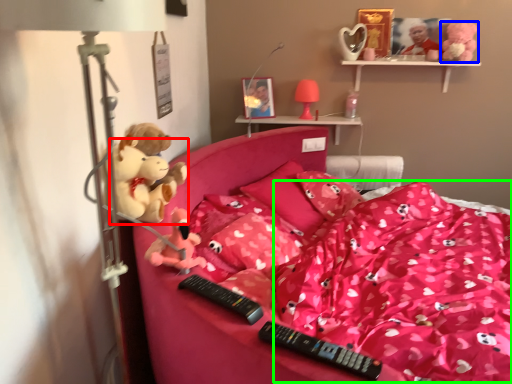
Question: Based on their relative distances, which object is nearer to toy (highlighted by a red box)? Choose from toy (highlighted by a blue box) and blanket (highlighted by a green box).

Choices:
 (A) toy
 (B) blanket

Answer: (B)